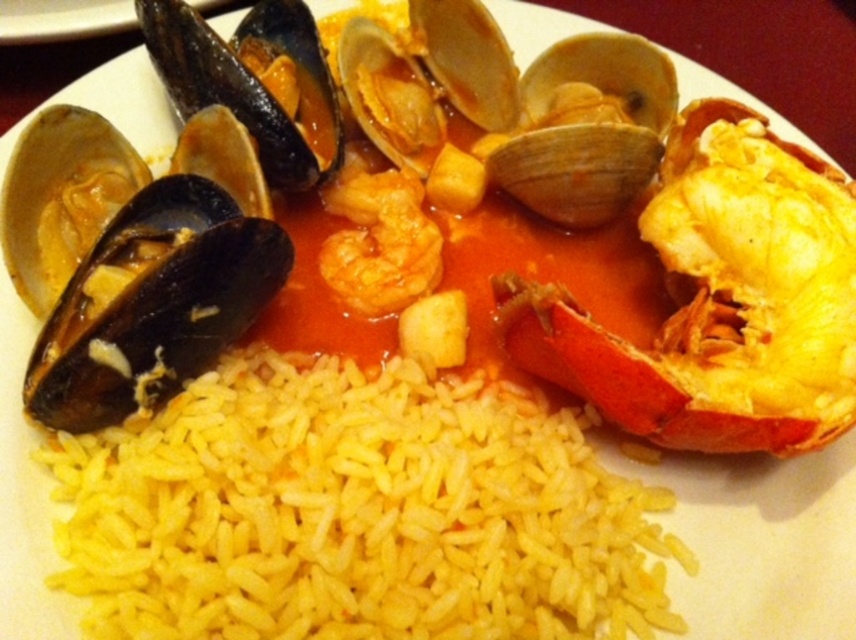
Question: Which of the following is the closest to the observer?

Choices:
 (A) yellow polished rice at center
 (B) black matte mussel at left

Answer: (A)

Question: Is the position of yellow polished rice at center less distant than that of black matte mussel at left?

Choices:
 (A) no
 (B) yes

Answer: (B)

Question: Is shiny orange shrimp at center further to the viewer compared to orange glossy shrimp at center?

Choices:
 (A) no
 (B) yes

Answer: (A)

Question: In this image, where is black matte mussel at left located relative to orange glossy shrimp at center?

Choices:
 (A) above
 (B) below

Answer: (B)

Question: Considering the real-world distances, which object is farthest from the shiny orange shrimp at center?

Choices:
 (A) orange glossy shrimp at center
 (B) black matte mussel at left

Answer: (B)

Question: Which object is farther from the camera taking this photo?

Choices:
 (A) shiny orange shrimp at center
 (B) black matte mussel at left
 (C) orange glossy shrimp at center
 (D) yellow polished rice at center

Answer: (C)